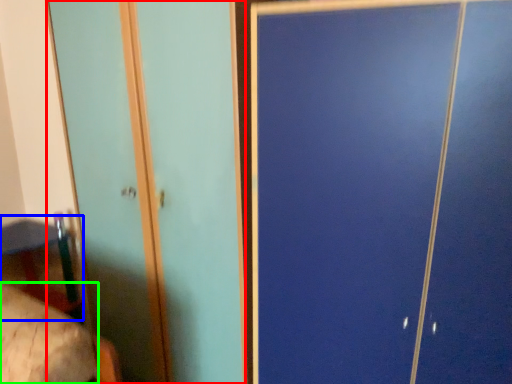
Question: Which is nearer to the screen door (highlighted by a red box)? table (highlighted by a blue box) or mattress (highlighted by a green box).

Choices:
 (A) table
 (B) mattress

Answer: (A)